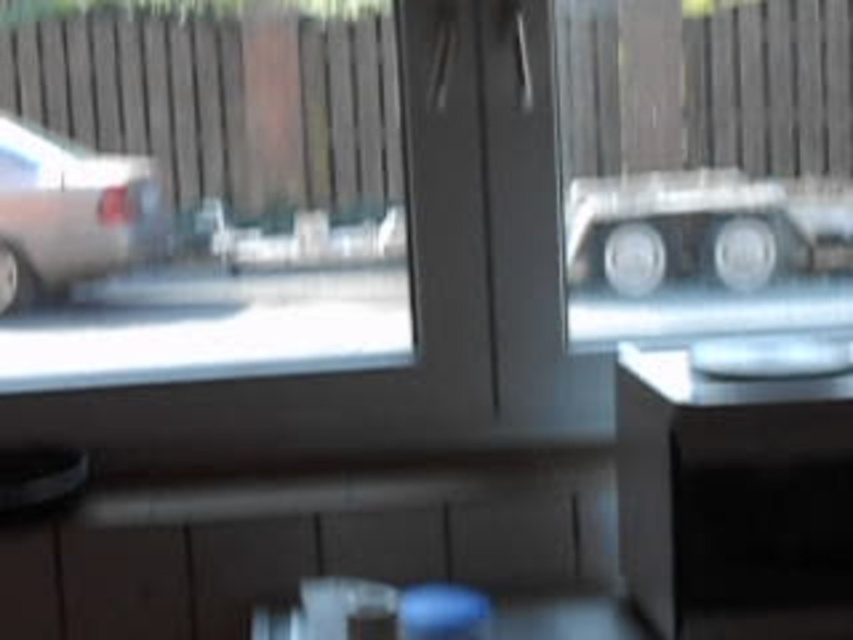
Question: Is clear glass window at upper left smaller than silver metallic car at left?

Choices:
 (A) no
 (B) yes

Answer: (A)

Question: Is clear glass window at upper left to the left of silver metallic car at left from the viewer's perspective?

Choices:
 (A) no
 (B) yes

Answer: (A)

Question: Among these points, which one is nearest to the camera?

Choices:
 (A) (111, 157)
 (B) (323, 209)

Answer: (A)

Question: Considering the relative positions of clear glass window at upper left and silver metallic car at left in the image provided, where is clear glass window at upper left located with respect to silver metallic car at left?

Choices:
 (A) above
 (B) below

Answer: (B)